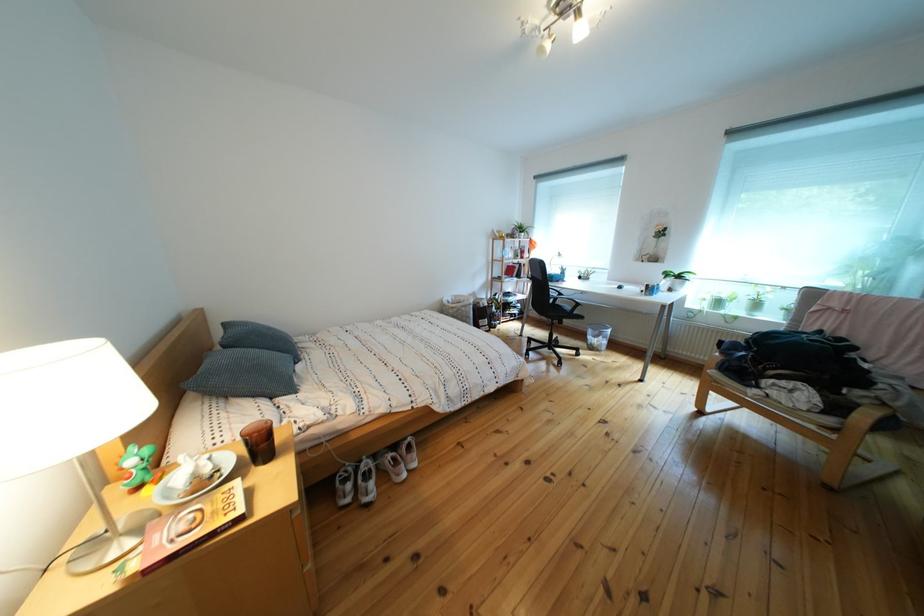
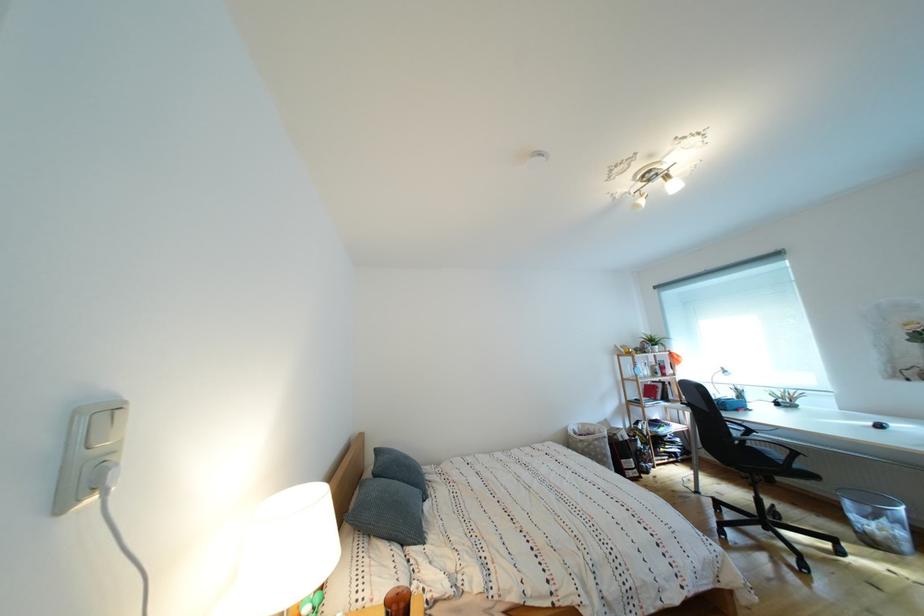
In the second image, find the point that corresponds to (x=520, y=265) in the first image.

(657, 383)